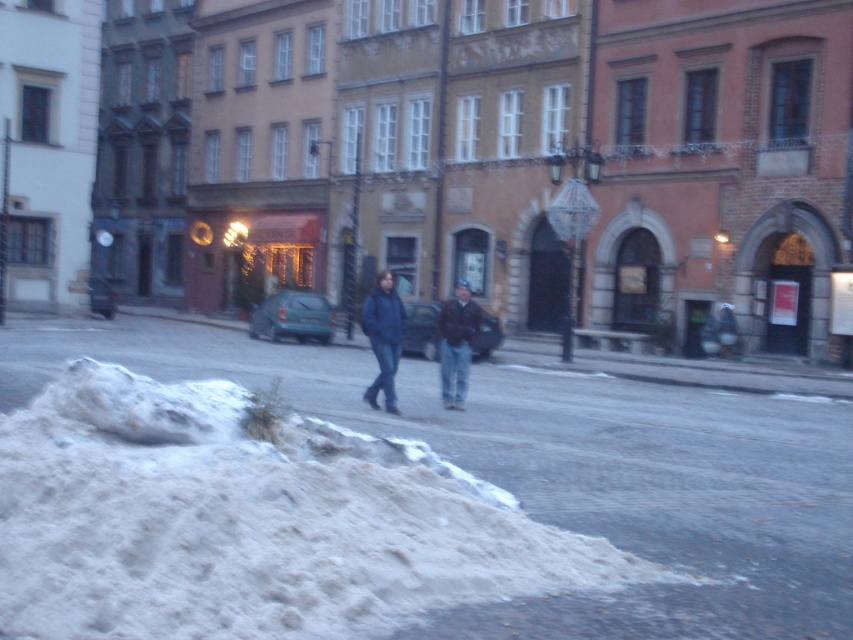
Question: Estimate the real-world distances between objects in this image. Which object is farther from the matte blue jacket at center?

Choices:
 (A) white powdery snow at lower left
 (B) dark brown leather jacket at center

Answer: (A)

Question: Which object is closer to the camera taking this photo?

Choices:
 (A) white powdery snow at lower left
 (B) dark brown leather jacket at center

Answer: (A)

Question: Can you confirm if matte blue jacket at center is bigger than dark brown leather jacket at center?

Choices:
 (A) no
 (B) yes

Answer: (B)

Question: Based on their relative distances, which object is nearer to the matte blue jacket at center?

Choices:
 (A) dark brown leather jacket at center
 (B) white powdery snow at lower left

Answer: (A)

Question: Does white powdery snow at lower left lie behind dark brown leather jacket at center?

Choices:
 (A) yes
 (B) no

Answer: (B)

Question: Does white powdery snow at lower left appear over dark brown leather jacket at center?

Choices:
 (A) yes
 (B) no

Answer: (B)